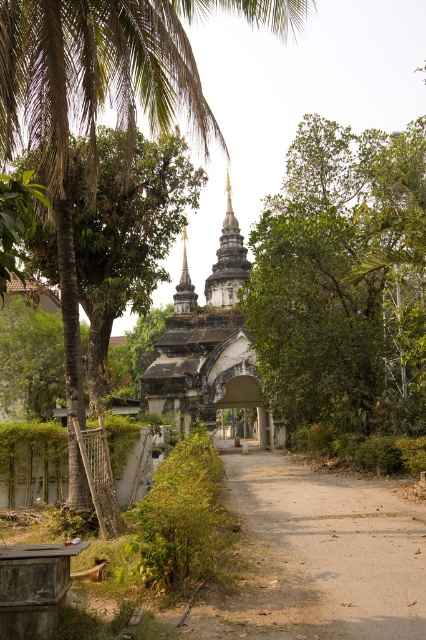
You are a hiker walking along the dirt path at center and want to take a photo of the green leafy palm tree at upper left. In which direction should you turn to face the tree?

The green leafy palm tree at upper left is to the left of the dirt path at center, so you should turn to your left to face the tree.